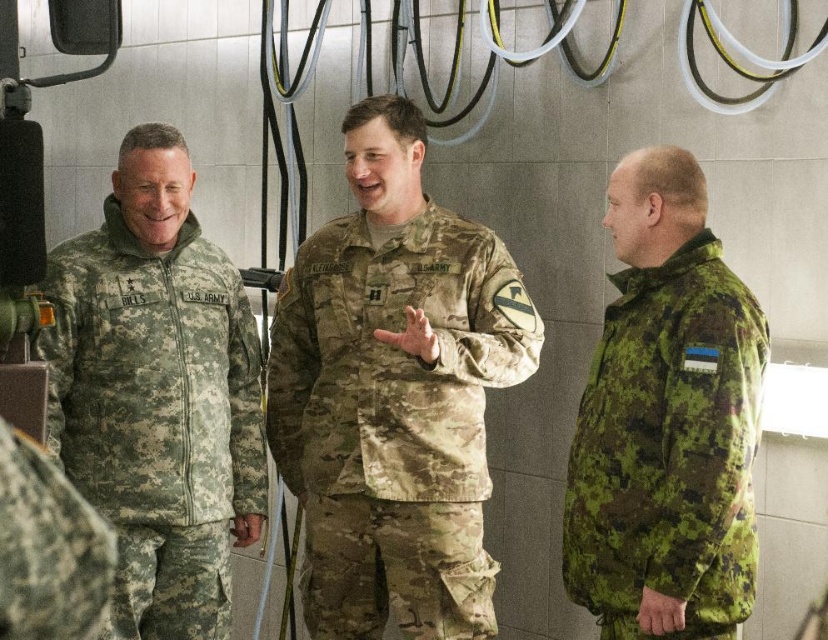
Question: Is camouflage fabric uniform at center behind camouflage fabric uniform at left?

Choices:
 (A) no
 (B) yes

Answer: (B)

Question: Can you confirm if camouflage fabric jacket at left is smaller than camouflage fabric jacket at right?

Choices:
 (A) yes
 (B) no

Answer: (B)

Question: Which of the following is the farthest from the observer?

Choices:
 (A) camouflage fabric uniform at left
 (B) camouflage fabric uniform at center
 (C) camouflage fabric jacket at right
 (D) camouflage fabric jacket at left

Answer: (B)

Question: Which point is closer to the camera?

Choices:
 (A) camouflage fabric uniform at center
 (B) camouflage fabric jacket at right
 (C) camouflage fabric uniform at left
 (D) camouflage fabric jacket at left

Answer: (C)

Question: Which point is closer to the camera taking this photo?

Choices:
 (A) (29, 576)
 (B) (304, 381)
 (C) (628, 529)

Answer: (A)

Question: Does camouflage fabric jacket at left come in front of camouflage fabric uniform at left?

Choices:
 (A) no
 (B) yes

Answer: (A)